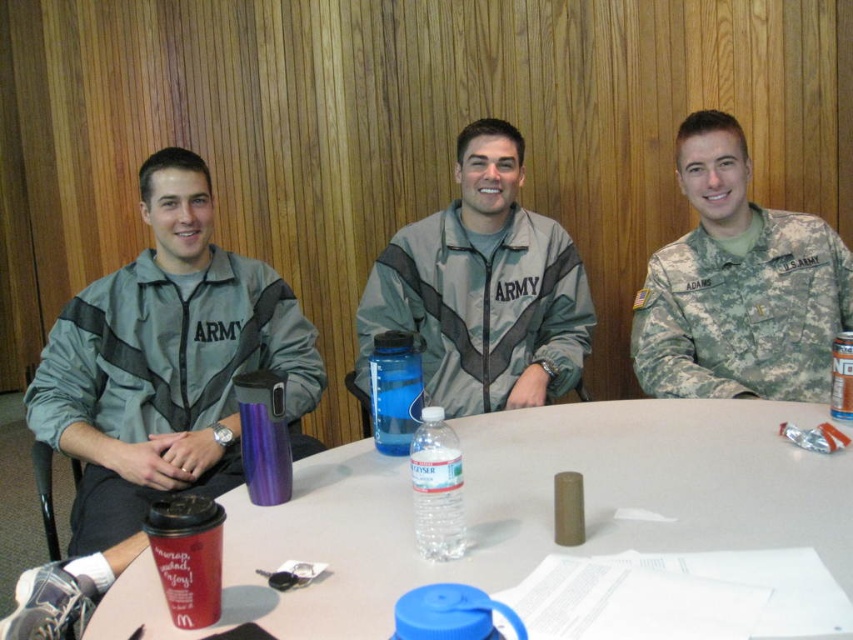
Which is more to the right, gray matte jacket at left or blue plastic water bottle at center?

Positioned to the right is blue plastic water bottle at center.

What do you see at coordinates (172, 352) in the screenshot?
I see `gray matte jacket at left` at bounding box center [172, 352].

Find the location of a particular element. gray matte jacket at left is located at coordinates (172, 352).

Is point (706, 234) more distant than point (389, 392)?

Yes, point (706, 234) is behind point (389, 392).

Is camouflage fabric uniform at center bigger than blue plastic water bottle at center?

Yes, camouflage fabric uniform at center is bigger than blue plastic water bottle at center.

Is point (792, 252) closer to viewer compared to point (380, 429)?

No, (792, 252) is further to viewer.

This screenshot has height=640, width=853. In order to click on camouflage fabric uniform at center in this screenshot , I will do `click(743, 310)`.

Between point (405, 308) and point (840, 275), which one is positioned behind?

The point (405, 308) is more distant.

Does point (546, 230) come farther from viewer compared to point (735, 268)?

Yes, point (546, 230) is behind point (735, 268).

At what (x,y) coordinates should I click in order to perform the action: click on gray matte jacket at center. Please return your answer as a coordinate pair (x, y). The image size is (853, 640). Looking at the image, I should click on (483, 289).